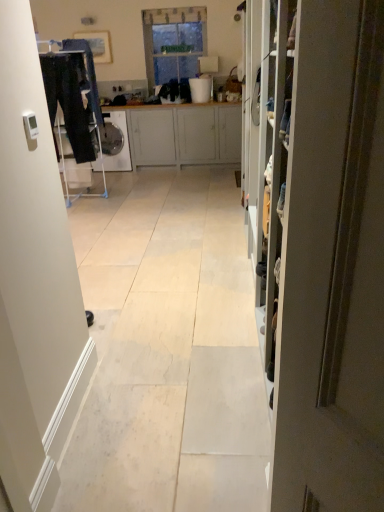
Question: Is white plastic bucket at upper center next to clear glass window at center?

Choices:
 (A) no
 (B) yes

Answer: (A)

Question: From the image's perspective, is white plastic bucket at upper center beneath clear glass window at center?

Choices:
 (A) yes
 (B) no

Answer: (A)

Question: Is the depth of white plastic bucket at upper center greater than that of clear glass window at center?

Choices:
 (A) yes
 (B) no

Answer: (B)

Question: Could you tell me if white plastic bucket at upper center is turned towards clear glass window at center?

Choices:
 (A) no
 (B) yes

Answer: (A)

Question: Is white plastic bucket at upper center at the left side of clear glass window at center?

Choices:
 (A) no
 (B) yes

Answer: (A)

Question: Considering the positions of matte gray door at right and light gray wood cabinet at center in the image, is matte gray door at right wider or thinner than light gray wood cabinet at center?

Choices:
 (A) thin
 (B) wide

Answer: (A)

Question: Is matte gray door at right situated inside light gray wood cabinet at center or outside?

Choices:
 (A) inside
 (B) outside

Answer: (B)

Question: From a real-world perspective, relative to light gray wood cabinet at center, is matte gray door at right vertically above or below?

Choices:
 (A) above
 (B) below

Answer: (A)

Question: Is matte gray door at right in front of or behind light gray wood cabinet at center in the image?

Choices:
 (A) front
 (B) behind

Answer: (A)

Question: Considering the positions of matte gray door at right and white plastic bucket at upper center in the image, is matte gray door at right taller or shorter than white plastic bucket at upper center?

Choices:
 (A) short
 (B) tall

Answer: (B)

Question: From the image's perspective, is matte gray door at right positioned above or below white plastic bucket at upper center?

Choices:
 (A) below
 (B) above

Answer: (A)

Question: Is matte gray door at right in front of or behind white plastic bucket at upper center in the image?

Choices:
 (A) behind
 (B) front

Answer: (B)

Question: Do you think matte gray door at right is within white plastic bucket at upper center, or outside of it?

Choices:
 (A) outside
 (B) inside

Answer: (A)

Question: Is dark blue jeans at left to the left or to the right of clear glass window at center in the image?

Choices:
 (A) left
 (B) right

Answer: (A)

Question: Does point (59, 103) appear closer or farther from the camera than point (205, 17)?

Choices:
 (A) closer
 (B) farther

Answer: (A)